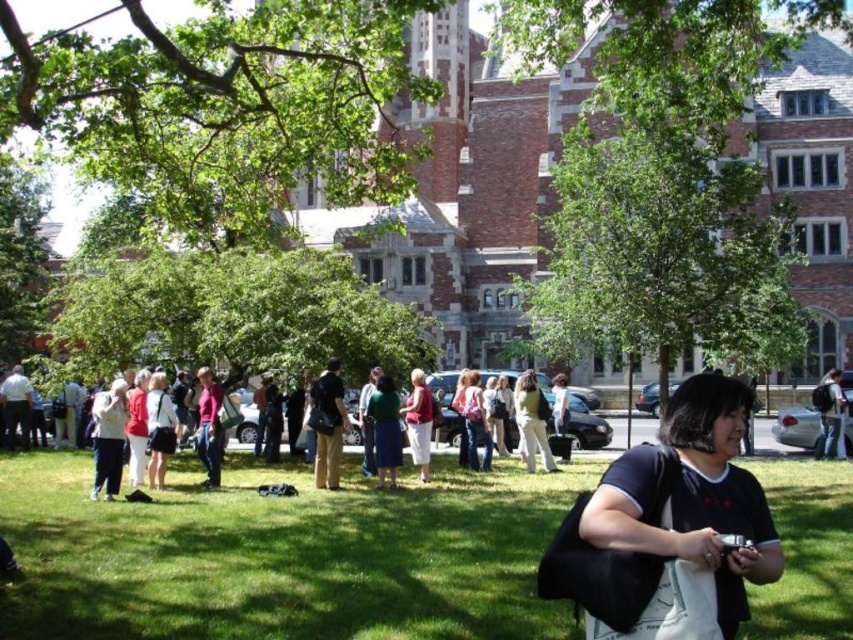
You are a photographer standing on the grassy area. You want to capture a photo of the person wearing the matte pink blouse at center and the person wearing denim pants at center in the same frame. Can you fit both subjects into your camera viewfinder if your camera has a minimum focus distance of 3 meters?

The distance between the matte pink blouse at center and denim pants at center is 4.33 meters. Since the camera requires a minimum focus distance of 3 meters, both subjects can be captured in the same frame as the distance between them is greater than the required minimum focus distance.

You are standing at the point with coordinates (282, 556) in the image. What is the surface you are standing on?

The point at coordinates (282, 556) corresponds to green grass at center, so you are standing on green grass at center.